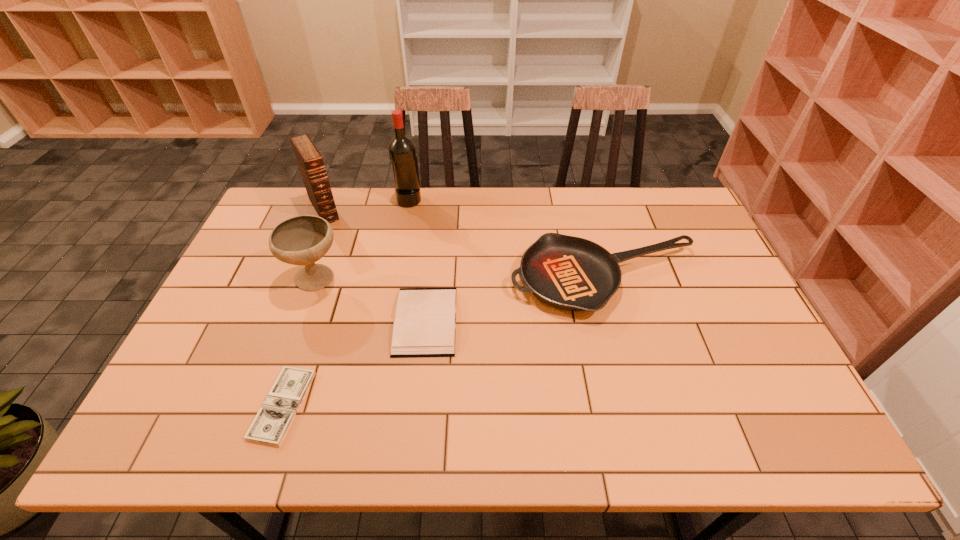
Identify the location of free space between the tallest object and the Bible. The height and width of the screenshot is (540, 960). (367, 204).

Where is `free spot between the rightmost object and the hardback book`? The width and height of the screenshot is (960, 540). free spot between the rightmost object and the hardback book is located at coordinates click(x=516, y=300).

At what (x,y) coordinates should I click in order to perform the action: click on object that stands as the fifth closest to the hardback book. Please return your answer as a coordinate pair (x, y). This screenshot has width=960, height=540. Looking at the image, I should click on (402, 152).

This screenshot has width=960, height=540. I want to click on object that is the third closest to the Bible, so click(x=425, y=319).

In order to click on vacant region that satisfies the following two spatial constraints: 1. on the front side of the fourth tallest object; 2. on the right side of the Bible in this screenshot , I will do `click(296, 280)`.

Identify the location of free space that satisfies the following two spatial constraints: 1. on the back side of the tallest object; 2. on the left side of the fourth shortest object. This screenshot has width=960, height=540. [346, 199].